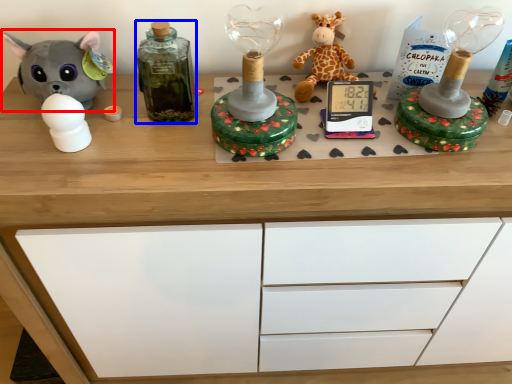
Question: Which point is further to the camera, toy (highlighted by a red box) or bottle (highlighted by a blue box)?

Choices:
 (A) toy
 (B) bottle

Answer: (A)